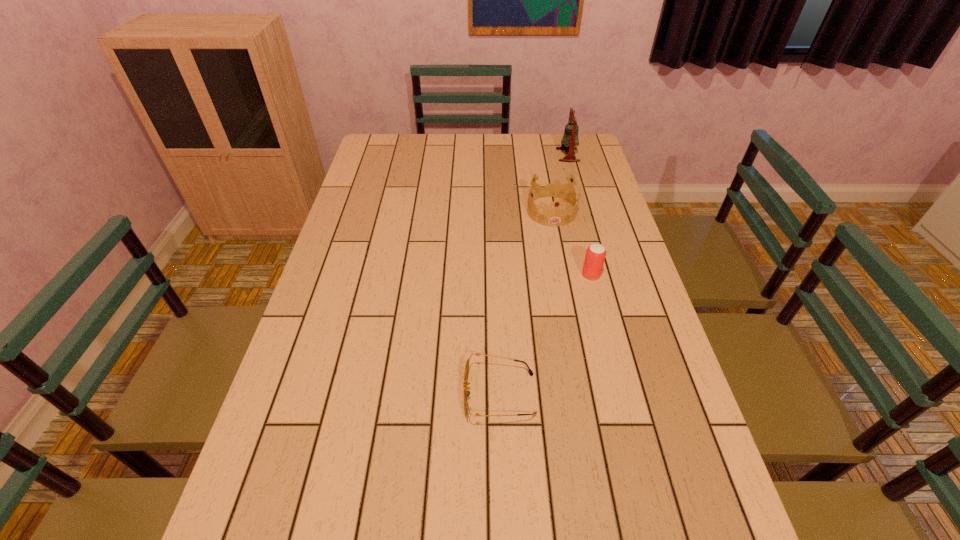
I want to click on free space located on the lenses of the leftmost object, so click(x=414, y=394).

Find the location of a particular element. vacant point located on the lenses of the leftmost object is located at coordinates (414, 394).

You are a GUI agent. You are given a task and a screenshot of the screen. Output one action in this format:
    pyautogui.click(x=<x>, y=<y>)
    Task: Click on the object at the far edge
    
    Given the screenshot: What is the action you would take?
    pyautogui.click(x=570, y=138)

This screenshot has height=540, width=960. I want to click on bell that is positioned at the right edge, so point(570,138).

In order to click on tiara at the right edge in this screenshot , I will do `click(556, 216)`.

You are a GUI agent. You are given a task and a screenshot of the screen. Output one action in this format:
    pyautogui.click(x=<x>, y=<y>)
    Task: Click on the beer can located in the right edge section of the desktop
    The width and height of the screenshot is (960, 540).
    Given the screenshot: What is the action you would take?
    pyautogui.click(x=595, y=256)

Locate an element on the screen. The width and height of the screenshot is (960, 540). object that is at the far right corner is located at coordinates (570, 138).

You are a GUI agent. You are given a task and a screenshot of the screen. Output one action in this format:
    pyautogui.click(x=<x>, y=<y>)
    Task: Click on the blank space at the far edge of the desktop
    The height and width of the screenshot is (540, 960).
    Given the screenshot: What is the action you would take?
    pyautogui.click(x=498, y=147)

Where is `vacant area at the left edge`? Image resolution: width=960 pixels, height=540 pixels. vacant area at the left edge is located at coordinates (350, 234).

Where is `free space at the right edge`? This screenshot has width=960, height=540. free space at the right edge is located at coordinates (605, 277).